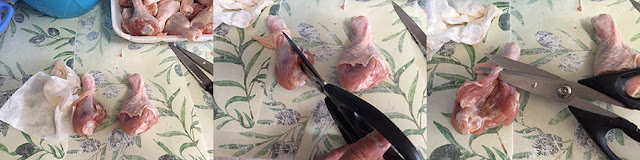
The height and width of the screenshot is (160, 640). I want to click on paper towel, so click(42, 110), click(459, 24), click(230, 12).